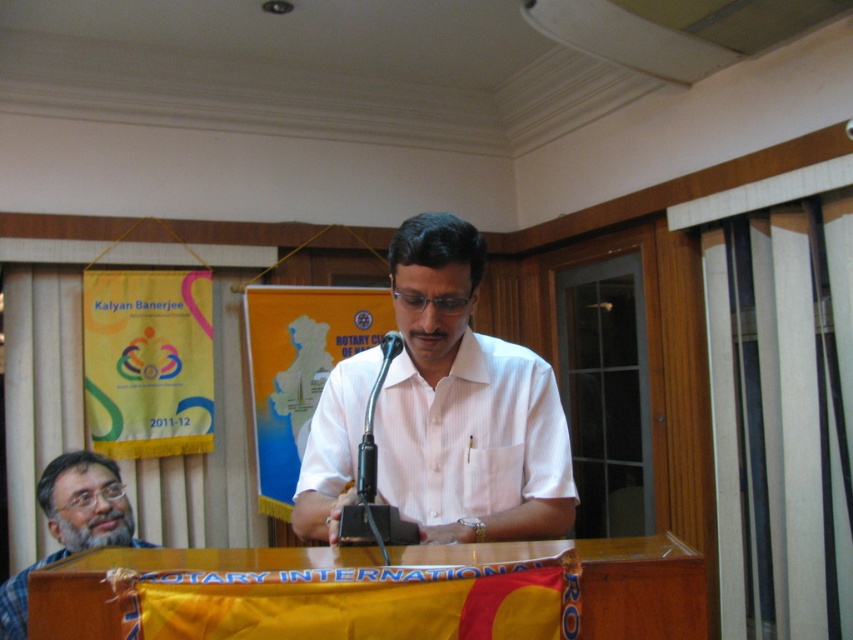
Consider the image. You are an event photographer at the Rotary International event. You need to capture a closeup shot of the speaker while ensuring the black plastic microphone at center is visible in the frame. Is the white striped shirt at center blocking the view of the microphone?

The white striped shirt at center is above the black plastic microphone at center, so the shirt is blocking the microphone from view.

You are a photographer positioned in front of the podium. You need to capture a clear shot of the black plastic microphone at center without the gray checkered shirt at lower left blocking it. Is this possible given their positions?

The gray checkered shirt at lower left is further to the viewer than the black plastic microphone at center, so the shirt will block the microphone in the shot. Move the camera position to avoid the shirt or adjust the angle to exclude the shirt from the frame.

You are a photographer at the event and want to capture a photo of the speaker holding the black plastic microphone at center. However, the white striped shirt at center is blocking the view. Can you adjust your position to see the microphone behind the shirt?

The black plastic microphone at center is behind the white striped shirt at center, so adjusting your position slightly to the side might allow you to see the microphone behind the shirt.